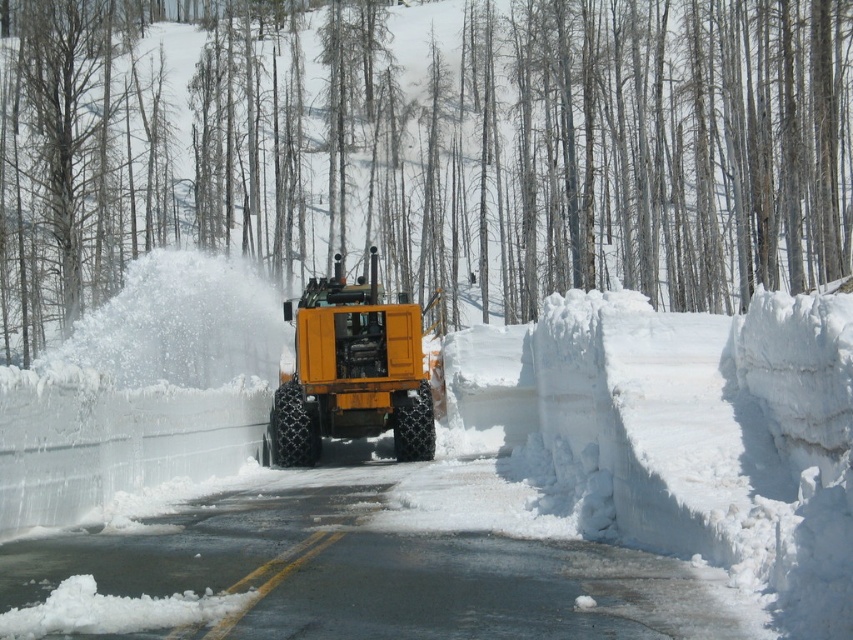
You are a snowplow operator who needs to clear the road efficiently. The white fluffy snow at center and smooth snow at center are two distinct areas you must address. Given their distance apart, can you estimate whether the gap between them is large enough to allow a standard dump truck to pass through safely?

The gap between the white fluffy snow at center and smooth snow at center is 123.55 feet, which is more than sufficient for a standard dump truck to pass through safely as it requires only about 50 feet of clearance.

You are a snowplow operator who needs to clear the road. You see the point at coordinates [453,458] marked as white fluffy snow at center. Can you safely drive over the white fluffy snow at center without getting stuck?

The point at coordinates [453,458] indicates white fluffy snow at center, which is likely less compacted and more prone to causing the vehicle to sink or lose traction. Therefore, it is not safe to drive over the white fluffy snow at center without risking getting stuck.

You are a delivery driver trying to navigate through the snow. You need to know if the smooth snow at center is above or below the yellow rubber tire at center to adjust your driving path. Which direction should you steer the vehicle?

The smooth snow at center is located above the yellow rubber tire at center, so you should steer the vehicle to avoid the area above the tire to prevent slipping on the smooth snow.